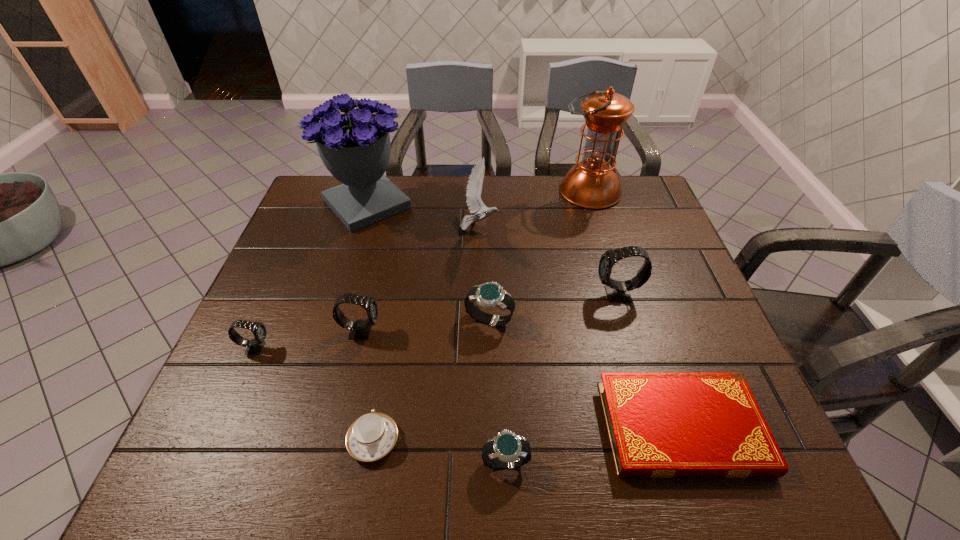
The image size is (960, 540). What are the coordinates of `vacant space located 0.390m on the cover of the hardback book` in the screenshot? It's located at (412, 428).

The height and width of the screenshot is (540, 960). In order to click on oil lamp located at the far edge in this screenshot , I will do `click(592, 183)`.

I want to click on bouquet that is at the far edge, so click(355, 147).

Locate an element on the screen. gull that is at the far edge is located at coordinates (474, 202).

In order to click on watch present at the near edge in this screenshot , I will do `click(507, 450)`.

Where is `teacup that is at the near edge`? teacup that is at the near edge is located at coordinates (372, 436).

At what (x,y) coordinates should I click in order to perform the action: click on hardback book positioned at the near edge. Please return your answer as a coordinate pair (x, y). This screenshot has width=960, height=540. Looking at the image, I should click on (661, 425).

The width and height of the screenshot is (960, 540). I want to click on bouquet that is positioned at the left edge, so click(355, 147).

Locate an element on the screen. watch that is at the left edge is located at coordinates (254, 346).

At what (x,y) coordinates should I click in order to perform the action: click on oil lamp that is at the right edge. Please return your answer as a coordinate pair (x, y). Looking at the image, I should click on (592, 183).